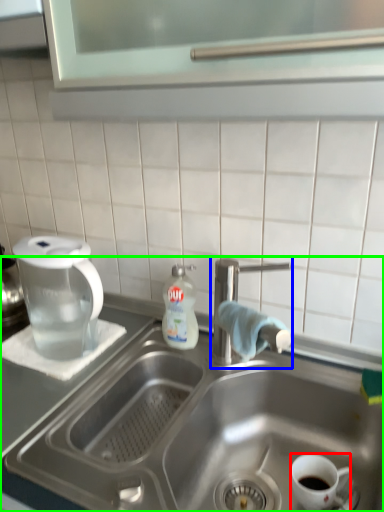
Question: Estimate the real-world distances between objects in this image. Which object is closer to coffee cup (highlighted by a red box), tap (highlighted by a blue box) or sink (highlighted by a green box)?

Choices:
 (A) tap
 (B) sink

Answer: (B)